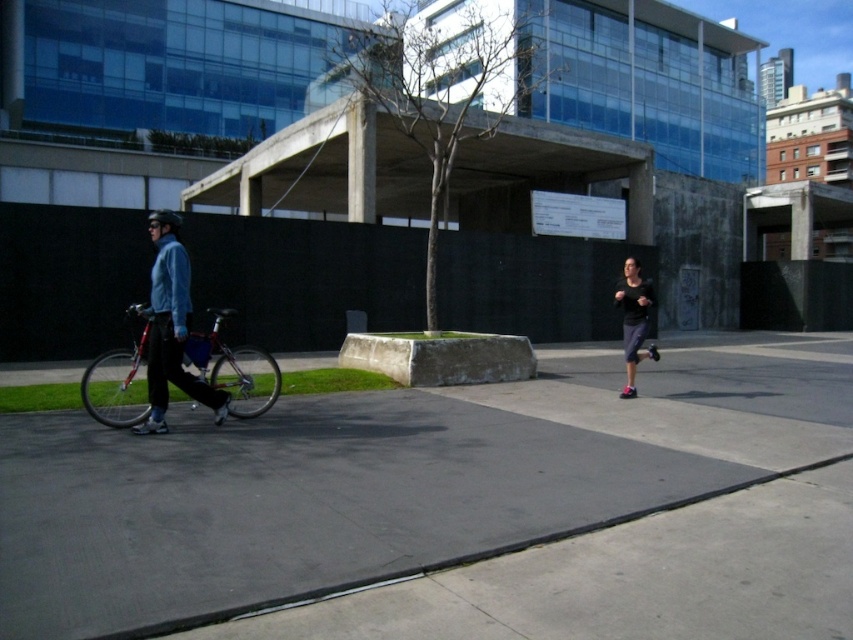
Based on the photo, who is more distant from viewer, (412, 419) or (154, 344)?

The point (412, 419) is more distant.

Does point (171, 531) come closer to viewer compared to point (186, 289)?

Yes.

This screenshot has width=853, height=640. In order to click on gray concrete pavement at center in this screenshot , I will do `click(457, 506)`.

Is point (225, 406) closer to camera compared to point (631, 296)?

Yes, it is.

Who is higher up, matte blue jacket at left or black matte running shoes at right?

matte blue jacket at left

Does point (173, 234) lie in front of point (637, 332)?

Yes, point (173, 234) is in front of point (637, 332).

Identify the location of matte blue jacket at left. (171, 326).

Does shiny metallic bicycle at left appear on the left side of matte blue jacket at left?

A: In fact, shiny metallic bicycle at left is to the right of matte blue jacket at left.

Which of these two, shiny metallic bicycle at left or matte blue jacket at left, stands taller?

Standing taller between the two is matte blue jacket at left.

This screenshot has width=853, height=640. Describe the element at coordinates (234, 369) in the screenshot. I see `shiny metallic bicycle at left` at that location.

This screenshot has height=640, width=853. What are the coordinates of `shiny metallic bicycle at left` in the screenshot? It's located at (234, 369).